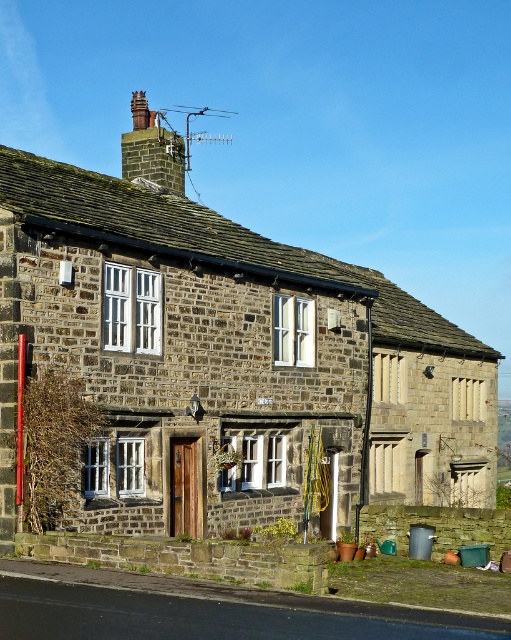
Between stone cottage at center and rusty metal chimney at upper center, which one has more height?

With more height is rusty metal chimney at upper center.

Does stone cottage at center appear on the left side of rusty metal chimney at upper center?

Incorrect, stone cottage at center is not on the left side of rusty metal chimney at upper center.

Between point (148, 301) and point (176, 168), which one is positioned in front?

Point (148, 301) is in front.

Find the location of `stone cottage at center`. stone cottage at center is located at coordinates (228, 364).